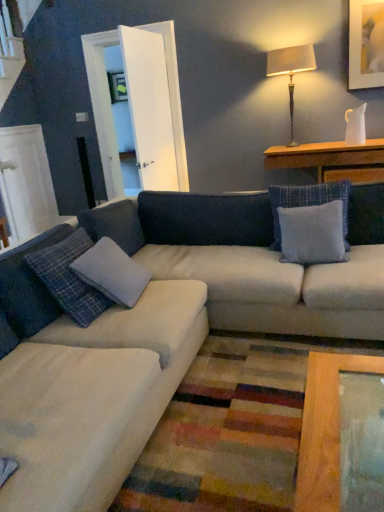
Question: From the image's perspective, is matte gold picture frame at upper right located beneath metallic gold table lamp at upper right?

Choices:
 (A) yes
 (B) no

Answer: (B)

Question: Is metallic gold table lamp at upper right inside matte gold picture frame at upper right?

Choices:
 (A) no
 (B) yes

Answer: (A)

Question: Can you confirm if matte gold picture frame at upper right is bigger than metallic gold table lamp at upper right?

Choices:
 (A) no
 (B) yes

Answer: (A)

Question: Is the depth of matte gold picture frame at upper right greater than that of metallic gold table lamp at upper right?

Choices:
 (A) yes
 (B) no

Answer: (B)

Question: Does matte gold picture frame at upper right have a lesser height compared to metallic gold table lamp at upper right?

Choices:
 (A) no
 (B) yes

Answer: (B)

Question: Looking at the image, does plaid fabric pillow at lower left, the 1th pillow positioned from the left, seem bigger or smaller compared to metallic gold table lamp at upper right?

Choices:
 (A) small
 (B) big

Answer: (A)

Question: In the image, is plaid fabric pillow at lower left, the 1th pillow positioned from the left, on the left side or the right side of metallic gold table lamp at upper right?

Choices:
 (A) left
 (B) right

Answer: (A)

Question: Is plaid fabric pillow at lower left, arranged as the second pillow when viewed from the right, wider or thinner than metallic gold table lamp at upper right?

Choices:
 (A) wide
 (B) thin

Answer: (A)

Question: Choose the correct answer: Is plaid fabric pillow at lower left, the 1th pillow positioned from the left, inside metallic gold table lamp at upper right or outside it?

Choices:
 (A) outside
 (B) inside

Answer: (A)

Question: Is matte gold picture frame at upper right wider or thinner than wooden table at upper right?

Choices:
 (A) wide
 (B) thin

Answer: (B)

Question: From a real-world perspective, is matte gold picture frame at upper right physically located above or below wooden table at upper right?

Choices:
 (A) above
 (B) below

Answer: (A)

Question: Is point (359, 7) closer or farther from the camera than point (369, 165)?

Choices:
 (A) closer
 (B) farther

Answer: (B)

Question: From the image's perspective, is matte gold picture frame at upper right located above or below wooden table at upper right?

Choices:
 (A) below
 (B) above

Answer: (B)

Question: Would you say gray fabric pillow at center, marked as the first pillow in a right-to-left arrangement, is inside or outside plaid fabric pillow at lower left, arranged as the second pillow when viewed from the right?

Choices:
 (A) inside
 (B) outside

Answer: (B)

Question: Considering their positions, is gray fabric pillow at center, which is the second pillow in left-to-right order, located in front of or behind plaid fabric pillow at lower left, arranged as the second pillow when viewed from the right?

Choices:
 (A) front
 (B) behind

Answer: (B)